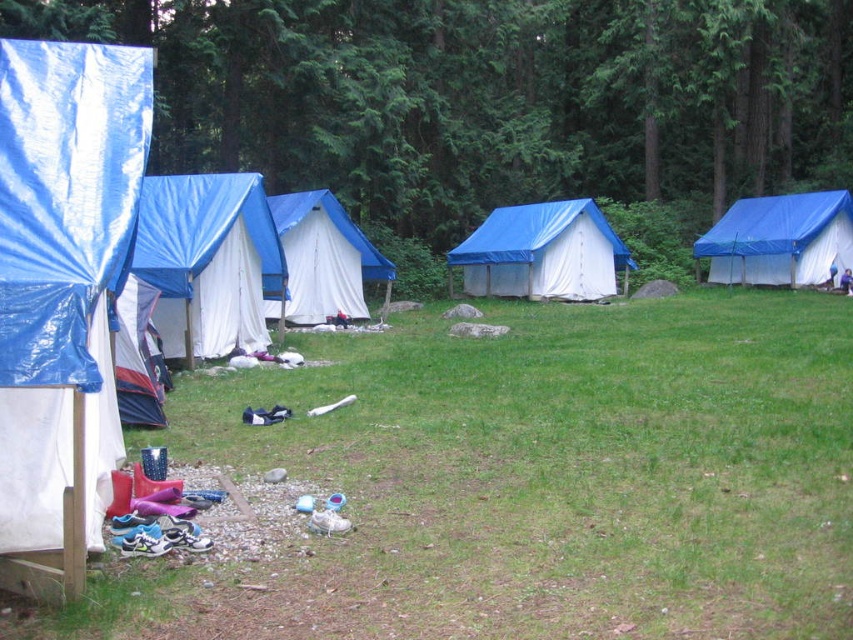
Question: Which of the following is the closest to the observer?

Choices:
 (A) (229, 173)
 (B) (128, 358)
 (C) (479, 282)
 (D) (781, 253)

Answer: (B)

Question: Is blue tarpaulin tent at center-left further to the viewer compared to blue tarpaulin tent at center?

Choices:
 (A) yes
 (B) no

Answer: (B)

Question: Estimate the real-world distances between objects in this image. Which object is closer to the white canvas tent at left?

Choices:
 (A) green grass at lower left
 (B) blue tarpaulin tent at center

Answer: (A)

Question: Which of the following is the farthest from the observer?

Choices:
 (A) (332, 209)
 (B) (120, 84)
 (C) (718, 280)

Answer: (C)

Question: Does green grass at lower left appear under blue tarpaulin tent at left?

Choices:
 (A) no
 (B) yes

Answer: (B)

Question: Observing the image, what is the correct spatial positioning of green grass at lower left in reference to blue tarpaulin tent at center-left?

Choices:
 (A) left
 (B) right

Answer: (B)